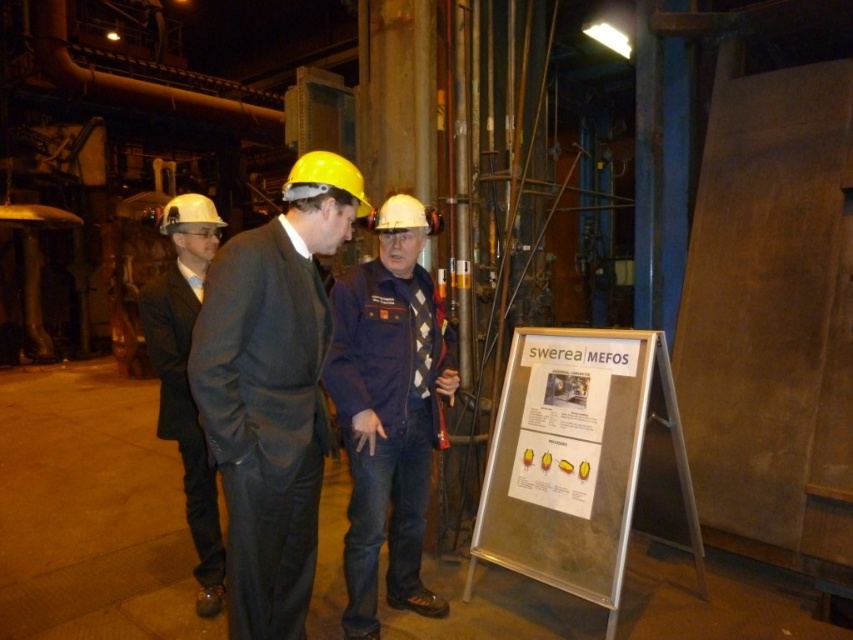
Find the location of a particular element. The height and width of the screenshot is (640, 853). blue denim jeans at center is located at coordinates (387, 412).

Can you confirm if matte black suit at center is smaller than white paper at center?

Actually, matte black suit at center might be larger than white paper at center.

Is point (259, 328) in front of point (564, 365)?

Yes, it is.

Locate an element on the screen. This screenshot has height=640, width=853. matte black suit at center is located at coordinates (271, 392).

Locate an element on the screen. This screenshot has width=853, height=640. matte black suit at center is located at coordinates (271, 392).

Can you confirm if white paper at center is positioned below matte black suit at left?

Actually, white paper at center is above matte black suit at left.

Identify the location of white paper at center. This screenshot has height=640, width=853. (566, 417).

This screenshot has height=640, width=853. Find the location of `white paper at center`. white paper at center is located at coordinates (566, 417).